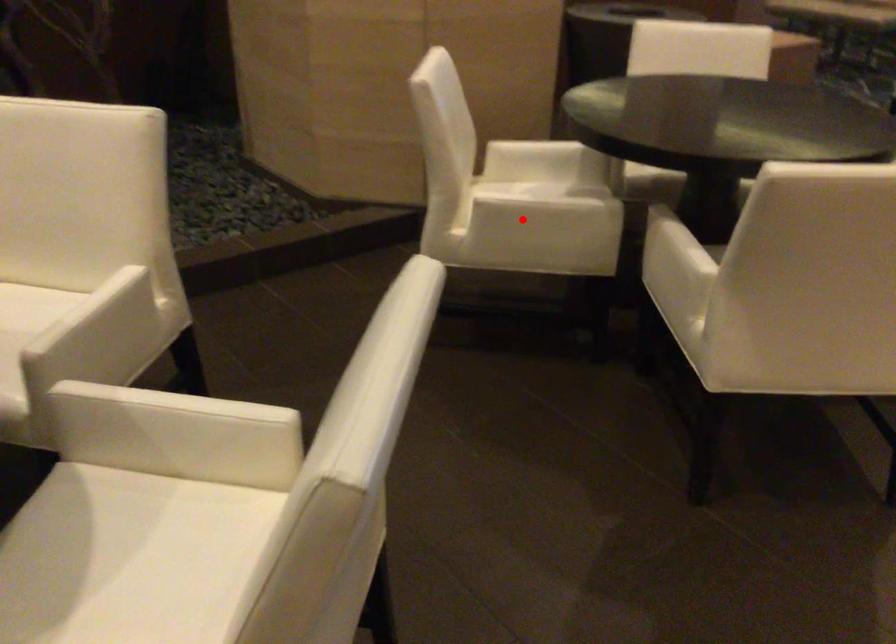
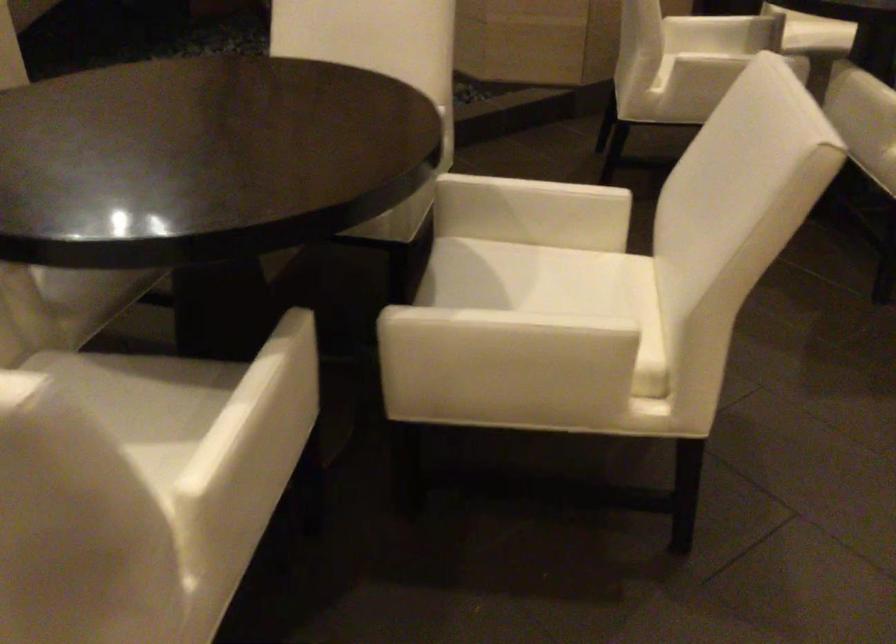
The point at the highlighted location is marked in the first image. Where is the corresponding point in the second image?

(726, 60)